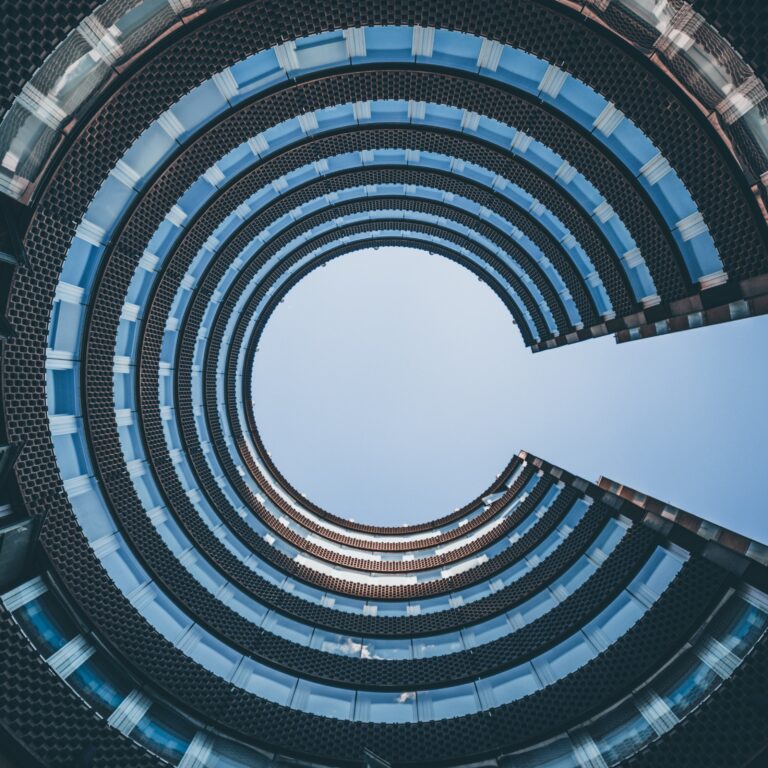
In order to click on floors in this screenshot , I will do `click(505, 288)`, `click(518, 269)`, `click(528, 249)`, `click(544, 222)`, `click(573, 190)`, `click(601, 126)`, `click(700, 65)`.